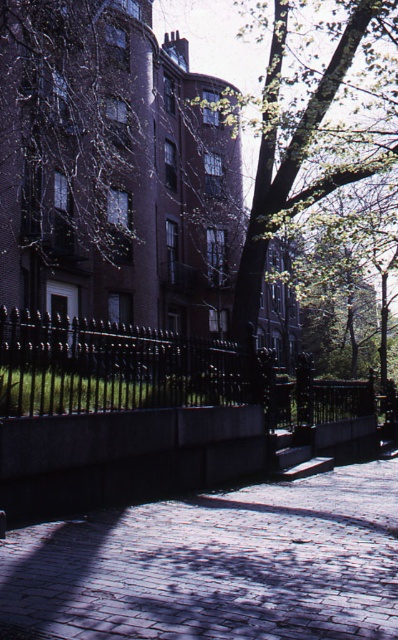
Question: Does cobblestone pavement at center have a greater width compared to green leafy tree at upper center?

Choices:
 (A) no
 (B) yes

Answer: (A)

Question: Can you confirm if cobblestone pavement at center is positioned to the left of green leafy tree at upper center?

Choices:
 (A) yes
 (B) no

Answer: (A)

Question: Does cobblestone pavement at center appear under green leafy tree at upper center?

Choices:
 (A) yes
 (B) no

Answer: (A)

Question: Among these points, which one is nearest to the camera?

Choices:
 (A) (298, 38)
 (B) (339, 634)

Answer: (B)